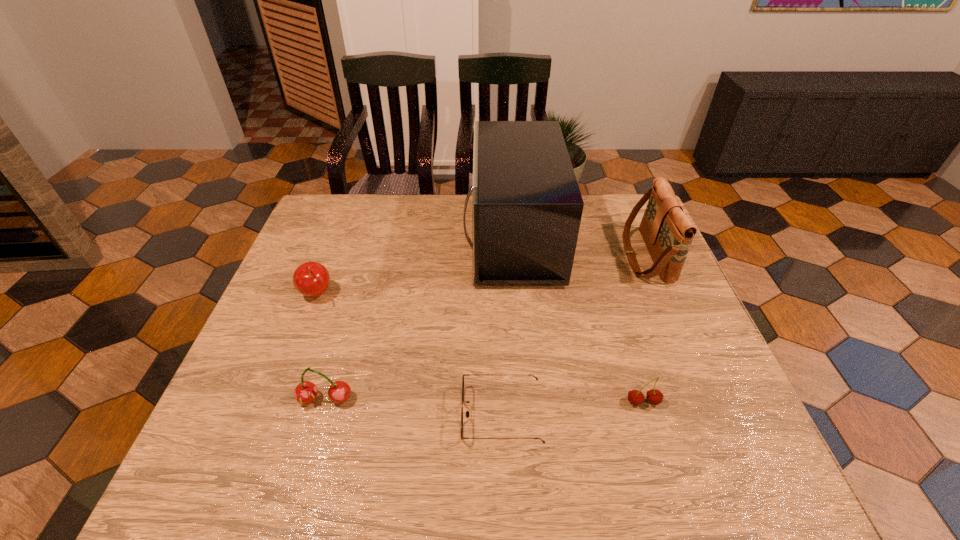
At what (x,y) coordinates should I click in order to perform the action: click on the tallest object. Please return your answer as a coordinate pair (x, y). Looking at the image, I should click on (x=527, y=207).

I want to click on the rightmost object, so click(x=667, y=232).

Identify the location of the fifth shortest object. This screenshot has width=960, height=540. (667, 232).

This screenshot has height=540, width=960. I want to click on the leftmost cherry, so click(311, 279).

You are a GUI agent. You are given a task and a screenshot of the screen. Output one action in this format:
    pyautogui.click(x=<x>, y=<y>)
    Task: Click on the leftmost object
    The image size is (960, 540).
    Given the screenshot: What is the action you would take?
    pyautogui.click(x=311, y=279)

What are the coordinates of `the second cherry from right to left` in the screenshot? It's located at (305, 392).

I want to click on the rightmost cherry, so click(x=635, y=397).

Locate an element on the screen. the second object from right to left is located at coordinates (635, 397).

In order to click on sunglasses in this screenshot , I will do `click(467, 412)`.

Where is `vacant area situated with the door open on the microwave oven`? vacant area situated with the door open on the microwave oven is located at coordinates (406, 238).